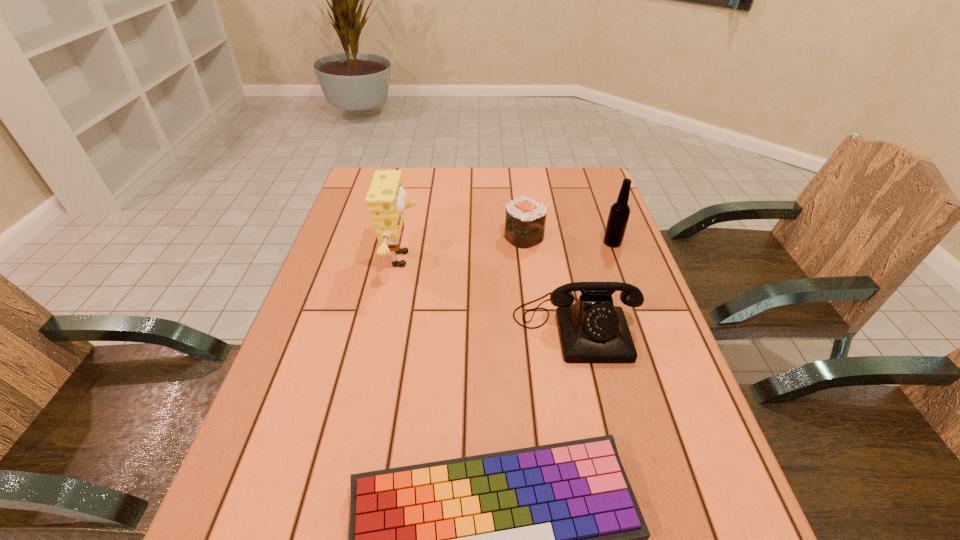
Find the location of `sponge`. sponge is located at coordinates (385, 199).

The width and height of the screenshot is (960, 540). In order to click on the fourth shortest object in this screenshot , I will do `click(619, 213)`.

Locate an element on the screen. Image resolution: width=960 pixels, height=540 pixels. telephone is located at coordinates (592, 330).

Image resolution: width=960 pixels, height=540 pixels. Find the location of `sushi`. sushi is located at coordinates click(x=525, y=219).

The height and width of the screenshot is (540, 960). I want to click on free space located 0.260m on the front-facing side of the sponge, so (517, 259).

Locate an element on the screen. vacant space located on the back of the beer bottle is located at coordinates (605, 221).

Find the location of a particular element. This screenshot has height=540, width=960. free location located 0.160m on the front face of the telephone is located at coordinates (598, 433).

The height and width of the screenshot is (540, 960). I want to click on vacant space situated on the front of the sushi, so click(x=540, y=365).

Where is `object located at the left edge`? The image size is (960, 540). object located at the left edge is located at coordinates (385, 199).

At what (x,y) coordinates should I click in order to perform the action: click on beer bottle located in the right edge section of the desktop. Please return your answer as a coordinate pair (x, y). This screenshot has width=960, height=540. Looking at the image, I should click on (619, 213).